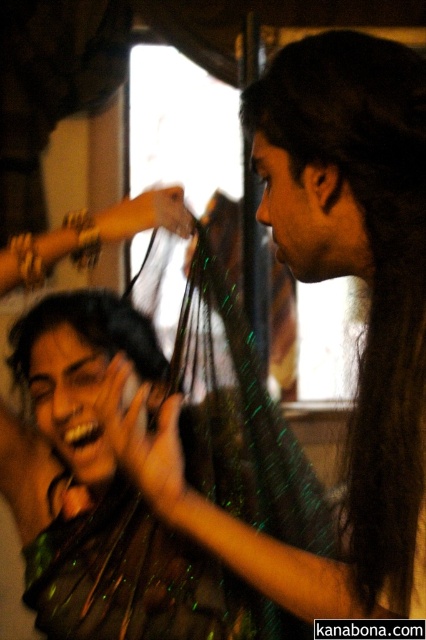
Does dark green silky hair at center have a lesser height compared to shiny black hair at center?

No, dark green silky hair at center is not shorter than shiny black hair at center.

Consider the image. Who is positioned more to the right, dark green silky hair at center or shiny black hair at center?

dark green silky hair at center is more to the right.

Where is `dark green silky hair at center`? This screenshot has width=426, height=640. dark green silky hair at center is located at coordinates (373, 262).

What are the coordinates of `dark green silky hair at center` in the screenshot? It's located at 373,262.